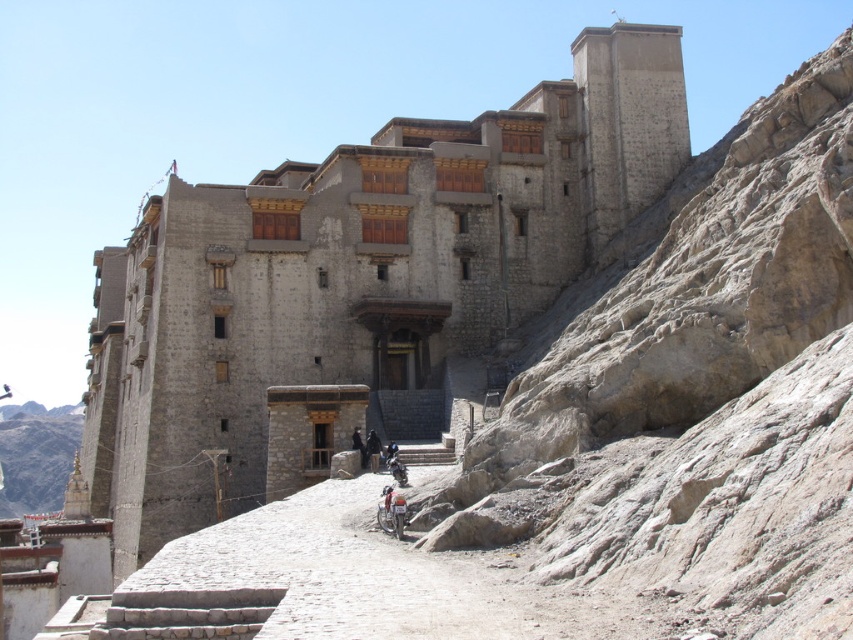
Can you confirm if white stone stupa at lower left is taller than shiny metallic motorcycle at center?

Yes, white stone stupa at lower left is taller than shiny metallic motorcycle at center.

Is white stone stupa at lower left further to camera compared to shiny metallic motorcycle at center?

Yes, it is behind shiny metallic motorcycle at center.

The height and width of the screenshot is (640, 853). Identify the location of white stone stupa at lower left. (36, 456).

In the scene shown: Who is lower down, gray stone building at center or metallic silver motorcycle at center?

metallic silver motorcycle at center

Who is positioned more to the left, gray stone building at center or metallic silver motorcycle at center?

gray stone building at center

Locate an element on the screen. gray stone building at center is located at coordinates (357, 273).

At what (x,y) coordinates should I click in order to perform the action: click on gray stone building at center. Please return your answer as a coordinate pair (x, y). The height and width of the screenshot is (640, 853). Looking at the image, I should click on (357, 273).

Which is behind, point (431, 268) or point (39, 422)?

The point (39, 422) is more distant.

Describe the element at coordinates (357, 273) in the screenshot. The width and height of the screenshot is (853, 640). I see `gray stone building at center` at that location.

Is point (265, 444) in front of point (67, 412)?

Yes, point (265, 444) is in front of point (67, 412).

Image resolution: width=853 pixels, height=640 pixels. I want to click on gray stone building at center, so click(x=357, y=273).